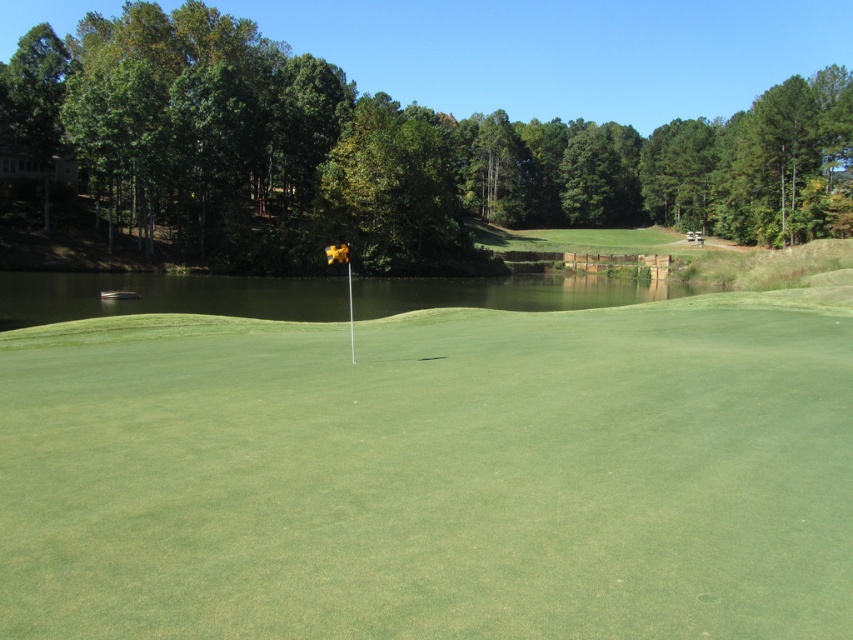
Question: Which of the following is the farthest from the observer?

Choices:
 (A) greenish water at center
 (B) green grassy golf course at center

Answer: (A)

Question: Which point is farther from the camera taking this photo?

Choices:
 (A) (113, 301)
 (B) (402, 481)

Answer: (A)

Question: Is green grassy golf course at center bigger than greenish water at center?

Choices:
 (A) no
 (B) yes

Answer: (A)

Question: Which point is farther to the camera?

Choices:
 (A) (786, 584)
 (B) (76, 310)

Answer: (B)

Question: Can you confirm if green grassy golf course at center is bigger than greenish water at center?

Choices:
 (A) no
 (B) yes

Answer: (A)

Question: Is green grassy golf course at center below greenish water at center?

Choices:
 (A) no
 (B) yes

Answer: (B)